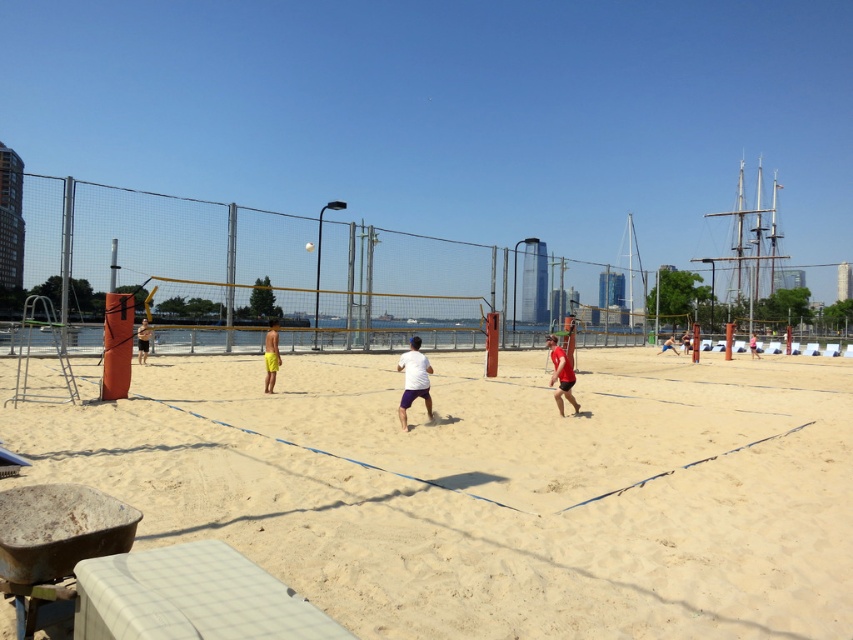
You are standing on the beach volleyball court and want to throw a ball to a friend who is exactly at the point labeled as point (x=312, y=481). If your throwing range is 25 feet, will you be able to reach them?

The point (x=312, y=481) is 23.52 feet from the viewer, which is within your throwing range of 25 feet. Yes, you can reach them.

You are a photographer positioned at the back of the volleyball court. You want to take a photo of the white matte shirt at center and the yellow fabric shorts at center so that both are fully visible in the frame. Which clothing item should you focus on first to ensure it is in focus, considering their heights?

The white matte shirt at center is shorter than the yellow fabric shorts at center, so you should focus on the yellow fabric shorts at center first since it is taller and will require adjusting the focus to capture its full height.

You are a photographer positioned at the edge of the volleyball court. You want to capture a shot where the white sand at center and the matte white shirt at center are both visible. Based on their positions, which object should you adjust your camera angle to focus on first to ensure both are in frame?

The white sand at center is to the left of matte white shirt at center, so you should focus on the matte white shirt at center first to ensure both the left and right positioned objects are captured in the frame.